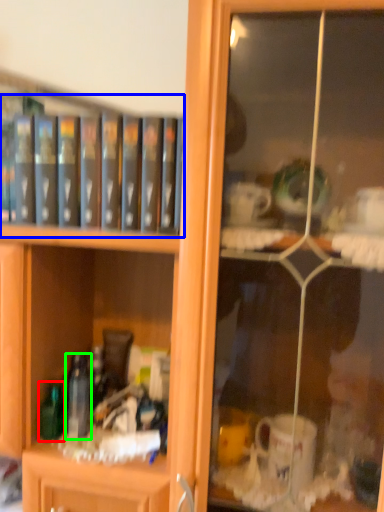
Question: Which is farther away from bottle (highlighted by a red box)? book (highlighted by a blue box) or bottle (highlighted by a green box)?

Choices:
 (A) book
 (B) bottle

Answer: (A)